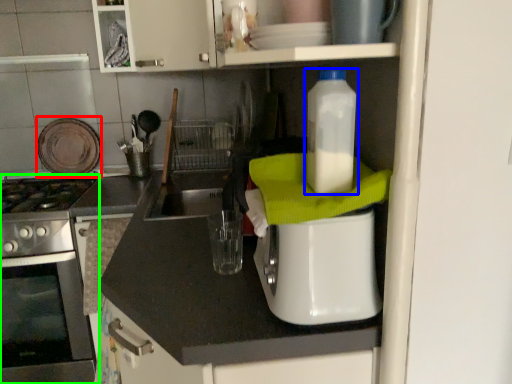
Question: Based on their relative distances, which object is nearer to appliance (highlighted by a red box)? Choose from bottle (highlighted by a blue box) and home appliance (highlighted by a green box).

Choices:
 (A) bottle
 (B) home appliance

Answer: (B)